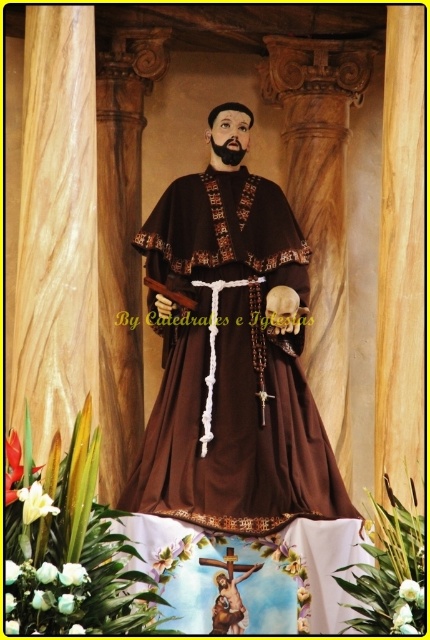
Question: Which point appears closest to the camera in this image?

Choices:
 (A) (246, 509)
 (B) (273, 296)

Answer: (A)

Question: Is brown matte robe at center further to the viewer compared to brown wooden skull at center?

Choices:
 (A) no
 (B) yes

Answer: (A)

Question: Which of the following is the closest to the observer?

Choices:
 (A) (291, 326)
 (B) (269, 236)

Answer: (A)

Question: Among these objects, which one is farthest from the camera?

Choices:
 (A) brown matte robe at center
 (B) brown wooden skull at center

Answer: (B)

Question: Does brown matte robe at center have a lesser width compared to brown wooden skull at center?

Choices:
 (A) no
 (B) yes

Answer: (A)

Question: Is brown matte robe at center positioned in front of brown wooden skull at center?

Choices:
 (A) no
 (B) yes

Answer: (B)